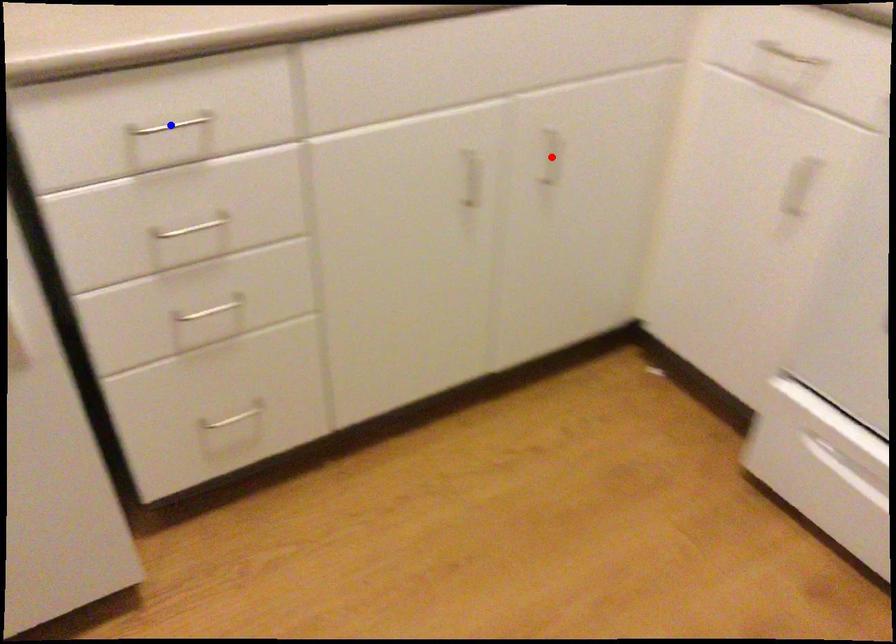
Question: Which of the two points in the image is closer to the camera?

Choices:
 (A) Blue point is closer.
 (B) Red point is closer.

Answer: (A)